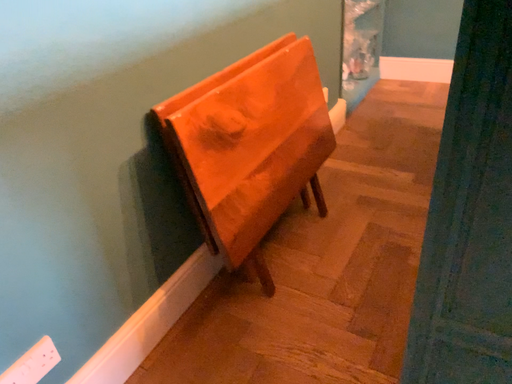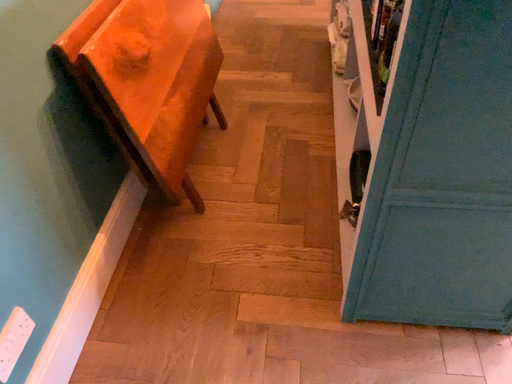
Question: Which way did the camera rotate in the video?

Choices:
 (A) rotated left
 (B) rotated right

Answer: (B)